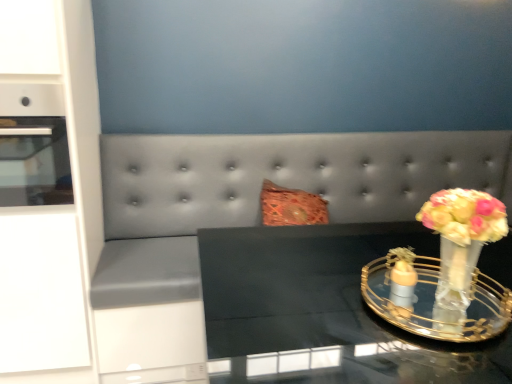
Question: From a real-world perspective, is suede gray couch at center positioned under matte orange glass candle holder at right, the 1th candle holder positioned from the left, based on gravity?

Choices:
 (A) no
 (B) yes

Answer: (B)

Question: Can you confirm if suede gray couch at center is taller than matte orange glass candle holder at right, the 2th candle holder from the right?

Choices:
 (A) no
 (B) yes

Answer: (B)

Question: Is suede gray couch at center smaller than matte orange glass candle holder at right, the 1th candle holder positioned from the left?

Choices:
 (A) no
 (B) yes

Answer: (A)

Question: From a real-world perspective, is suede gray couch at center physically above matte orange glass candle holder at right, the 2th candle holder from the right?

Choices:
 (A) no
 (B) yes

Answer: (A)

Question: Can you confirm if suede gray couch at center is shorter than matte orange glass candle holder at right, the 1th candle holder positioned from the left?

Choices:
 (A) no
 (B) yes

Answer: (A)

Question: Is suede gray couch at center in front of or behind white glossy cabinet at left in the image?

Choices:
 (A) front
 (B) behind

Answer: (B)

Question: Does point (159, 193) appear closer or farther from the camera than point (75, 230)?

Choices:
 (A) farther
 (B) closer

Answer: (A)

Question: From the image's perspective, is suede gray couch at center positioned above or below white glossy cabinet at left?

Choices:
 (A) below
 (B) above

Answer: (A)

Question: Considering the positions of suede gray couch at center and white glossy cabinet at left in the image, is suede gray couch at center taller or shorter than white glossy cabinet at left?

Choices:
 (A) short
 (B) tall

Answer: (A)

Question: Relative to white glossy cabinet at left, is clear glass vase at right, the 2th candle holder from the left, in front or behind?

Choices:
 (A) behind
 (B) front

Answer: (B)

Question: From their relative heights in the image, would you say clear glass vase at right, which is counted as the first candle holder, starting from the right, is taller or shorter than white glossy cabinet at left?

Choices:
 (A) tall
 (B) short

Answer: (B)

Question: Based on their sizes in the image, would you say clear glass vase at right, the 2th candle holder from the left, is bigger or smaller than white glossy cabinet at left?

Choices:
 (A) small
 (B) big

Answer: (A)

Question: In terms of width, does clear glass vase at right, the 2th candle holder from the left, look wider or thinner when compared to white glossy cabinet at left?

Choices:
 (A) thin
 (B) wide

Answer: (A)

Question: Is matte orange glass candle holder at right, the 2th candle holder from the right, bigger or smaller than translucent glass vase at right?

Choices:
 (A) big
 (B) small

Answer: (B)

Question: From a real-world perspective, is matte orange glass candle holder at right, the 2th candle holder from the right, physically located above or below translucent glass vase at right?

Choices:
 (A) above
 (B) below

Answer: (B)